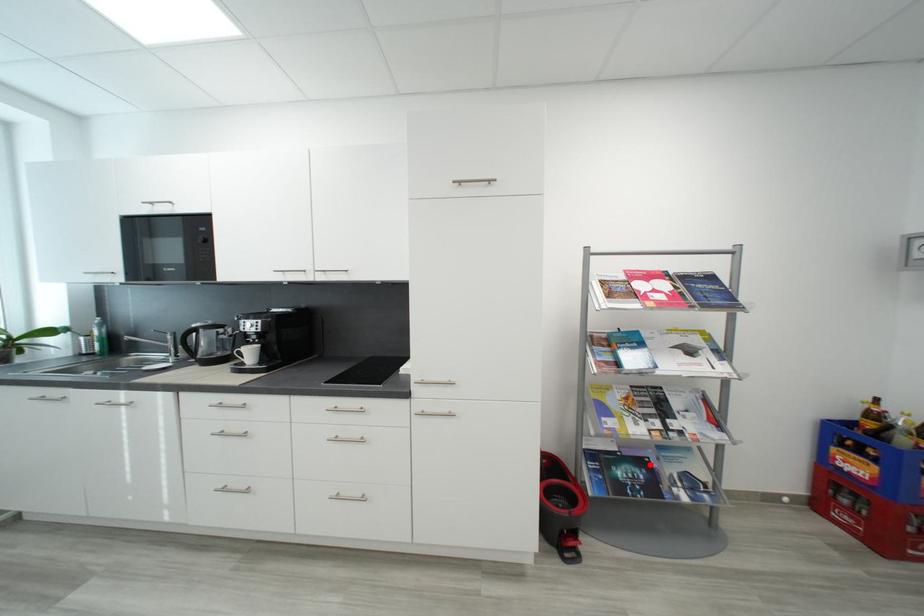
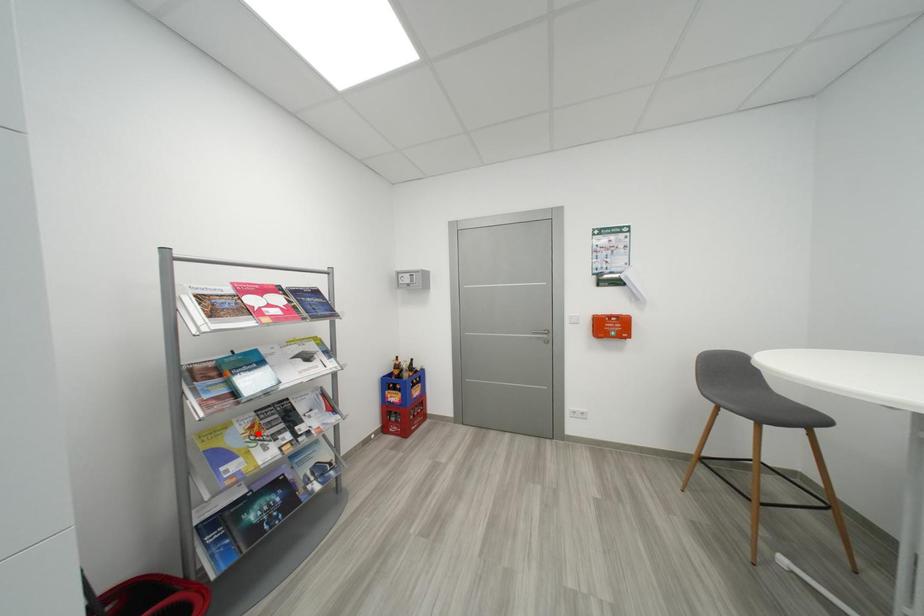
I am providing you with two images of the same scene from different viewpoints. A red point is marked on the first image and another point is marked on the second image. Are the points marked in image1 and image2 representing the same 3D position?

No